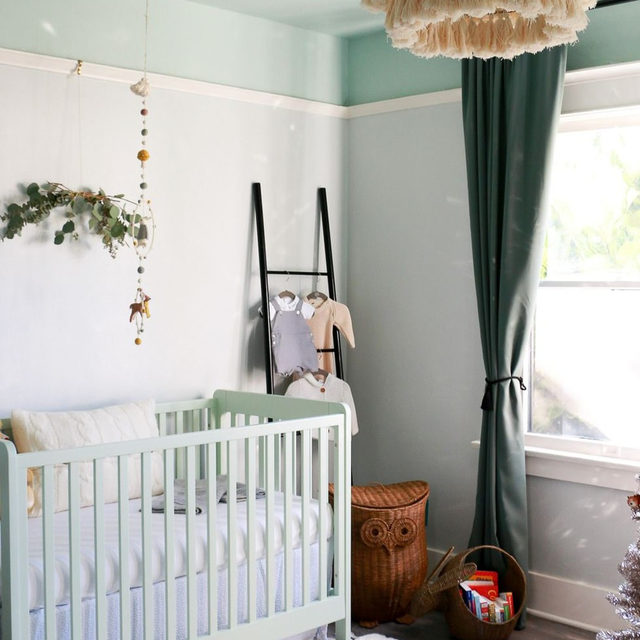
The width and height of the screenshot is (640, 640). Identify the location of window. (586, 264).